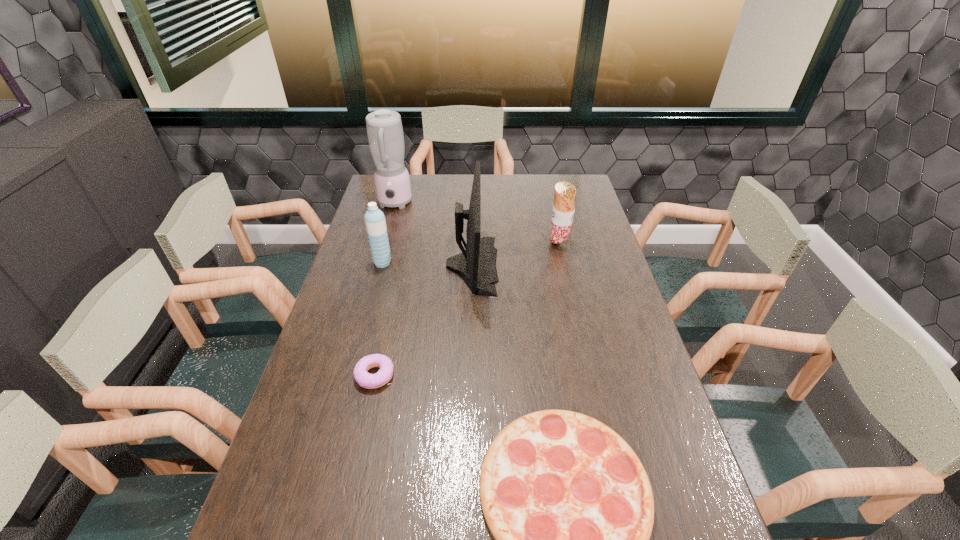
This screenshot has height=540, width=960. Identify the location of vacant space at the right edge. (573, 242).

Where is `vacant point located between the water bottle and the tallest object`? This screenshot has width=960, height=540. vacant point located between the water bottle and the tallest object is located at coordinates (389, 233).

I want to click on vacant area that lies between the fifth tallest object and the water bottle, so click(x=378, y=319).

Where is `vacant region between the doughnut and the monitor`? The image size is (960, 540). vacant region between the doughnut and the monitor is located at coordinates (423, 320).

Locate an element on the screen. empty location between the second nearest object and the burrito is located at coordinates (467, 310).

Identify the location of vacant space in between the second nearest object and the food processor. (385, 289).

You are a GUI agent. You are given a task and a screenshot of the screen. Output one action in this format:
    pyautogui.click(x=<x>, y=<y>)
    Task: Click on the vacant point located between the burrito and the doughnut
    This screenshot has height=540, width=960.
    Given the screenshot: What is the action you would take?
    [467, 310]

What are the coordinates of `object that is the nearest to the food processor` in the screenshot? It's located at (476, 265).

Identify the location of object that stands as the fourth closest to the water bottle. (563, 210).

Where is `vacant area in the image that satisfies the following two spatial constraints: 1. on the base of the food processor near the control knob; 2. on the left side of the water bottle`? vacant area in the image that satisfies the following two spatial constraints: 1. on the base of the food processor near the control knob; 2. on the left side of the water bottle is located at coordinates (378, 262).